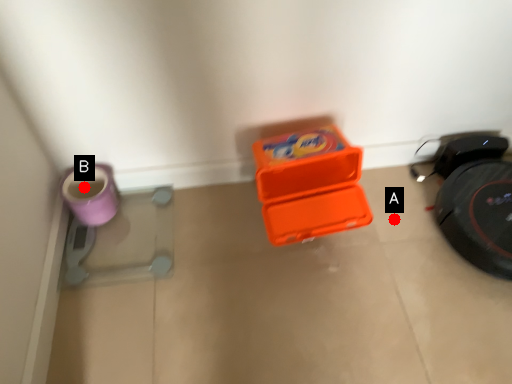
Question: Two points are circled on the image, labeled by A and B beside each circle. Which point is closer to the camera?

Choices:
 (A) A is closer
 (B) B is closer

Answer: (B)